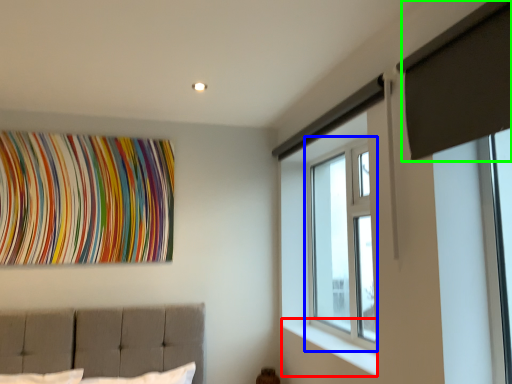
Question: Estimate the real-world distances between objects in this image. Which object is farther from window sill (highlighted by a red box), window (highlighted by a blue box) or curtain (highlighted by a green box)?

Choices:
 (A) window
 (B) curtain

Answer: (B)